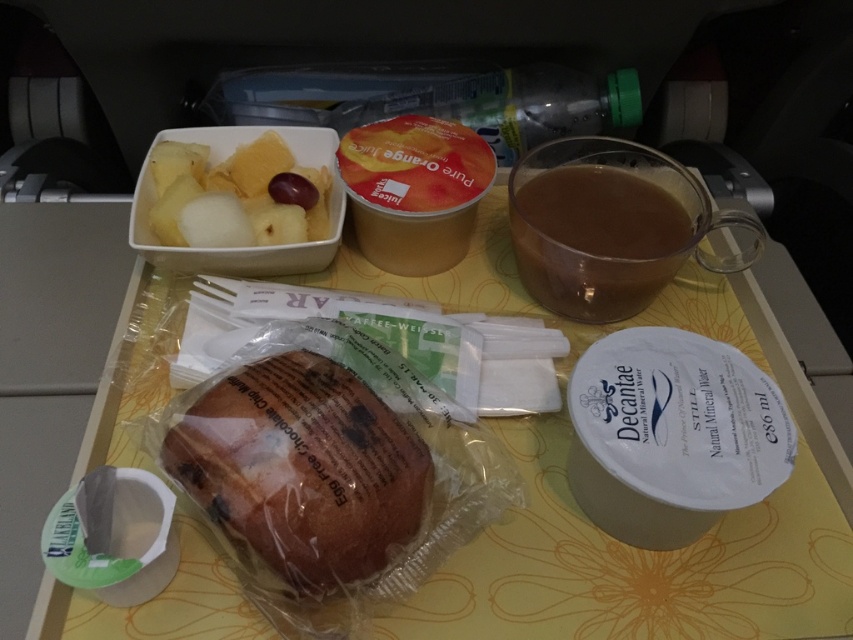
Question: Can you confirm if brown translucent glass at upper right is thinner than matte plastic fruit salad at upper left?

Choices:
 (A) yes
 (B) no

Answer: (B)

Question: Which point is closer to the camera?

Choices:
 (A) (677, 413)
 (B) (289, 182)
 (C) (251, 506)

Answer: (C)

Question: Which object appears farthest from the camera in this image?

Choices:
 (A) brown translucent glass at upper right
 (B) matte plastic fruit salad at upper left
 (C) white paper cup at upper center

Answer: (B)

Question: Can you confirm if brown translucent glass at upper right is positioned to the right of matte plastic fruit salad at upper left?

Choices:
 (A) yes
 (B) no

Answer: (A)

Question: Which of these objects is positioned farthest from the brown matte/soft bread at center?

Choices:
 (A) white paper cup at upper center
 (B) brown translucent glass at upper right

Answer: (B)

Question: Is white paper cup at upper center below matte plastic fruit salad at upper left?

Choices:
 (A) no
 (B) yes

Answer: (B)